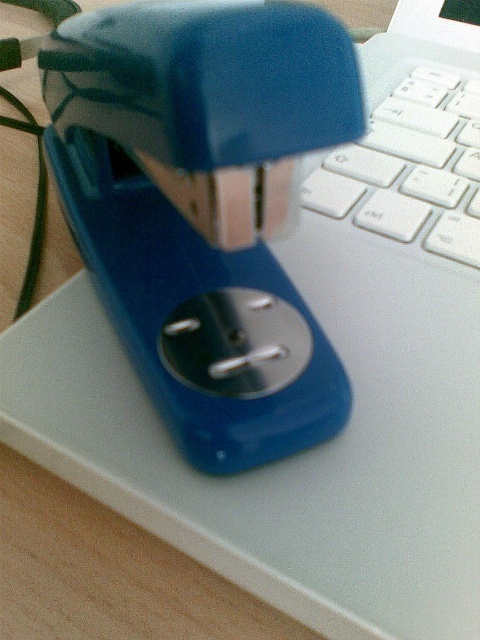
Question: Can you confirm if blue plastic stapler at center is positioned above white plastic keyboard at upper right?

Choices:
 (A) no
 (B) yes

Answer: (A)

Question: Which of the following is the farthest from the observer?

Choices:
 (A) white plastic keyboard at upper right
 (B) blue plastic stapler at center

Answer: (A)

Question: Does blue plastic stapler at center have a greater width compared to white plastic keyboard at upper right?

Choices:
 (A) yes
 (B) no

Answer: (A)

Question: Considering the relative positions of blue plastic stapler at center and white plastic keyboard at upper right in the image provided, where is blue plastic stapler at center located with respect to white plastic keyboard at upper right?

Choices:
 (A) right
 (B) left

Answer: (B)